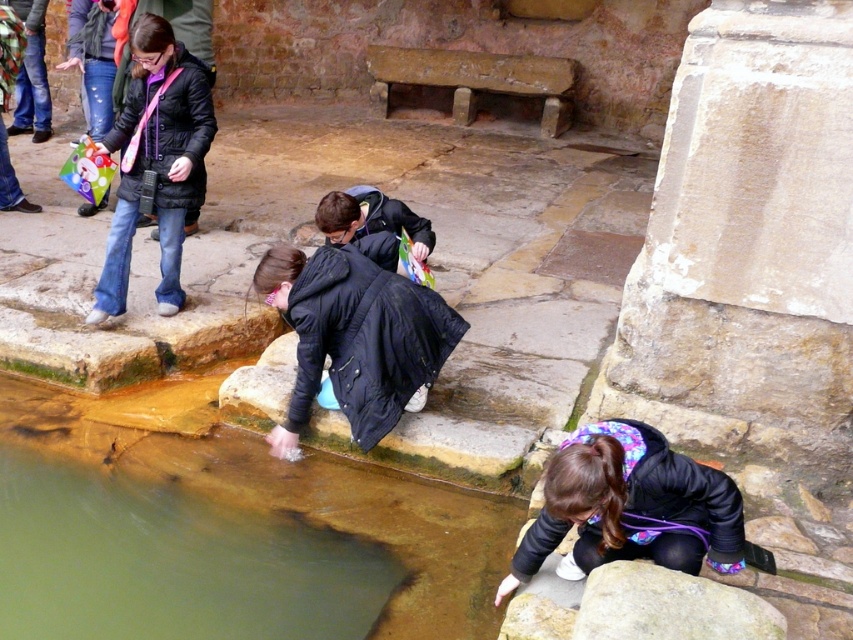
Question: Which object is farther from the camera taking this photo?

Choices:
 (A) green stone puddle at lower center
 (B) smooth gray rock at lower right
 (C) purple fleece jacket at lower center
 (D) matte black jacket at upper left

Answer: (D)

Question: Which object appears farthest from the camera in this image?

Choices:
 (A) matte black jacket at upper left
 (B) purple fleece jacket at lower center
 (C) black matte jacket at center

Answer: (A)

Question: Is green stone puddle at lower center thinner than black matte jacket at center?

Choices:
 (A) yes
 (B) no

Answer: (B)

Question: Is matte black jacket at upper left bigger than smooth gray rock at lower right?

Choices:
 (A) yes
 (B) no

Answer: (A)

Question: Based on their relative distances, which object is nearer to the green stone puddle at lower center?

Choices:
 (A) matte black jacket at upper left
 (B) black matte jacket at center

Answer: (B)

Question: Observing the image, what is the correct spatial positioning of green stone puddle at lower center in reference to black matte jacket at center?

Choices:
 (A) above
 (B) below

Answer: (B)